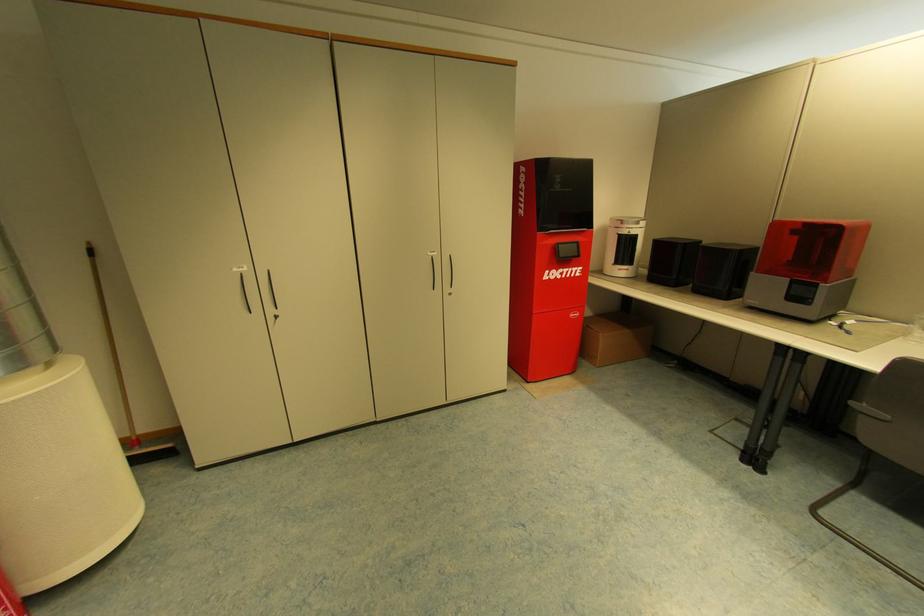
Where would you resting arm the chair armrest? Please return your answer as a coordinate pair (x, y).

(866, 408)